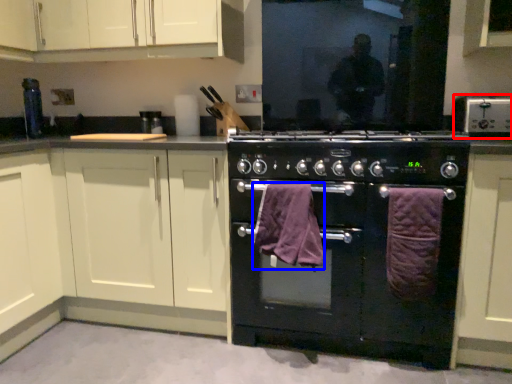
Question: Which of the following is the farthest to the observer, kitchen appliance (highlighted by a red box) or bath towel (highlighted by a blue box)?

Choices:
 (A) kitchen appliance
 (B) bath towel

Answer: (A)